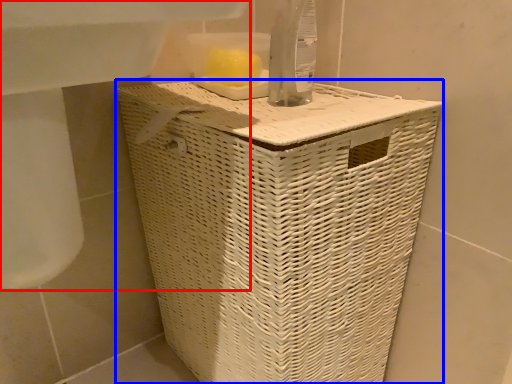
Question: Among these objects, which one is nearest to the camera, sink (highlighted by a red box) or waste container (highlighted by a blue box)?

Choices:
 (A) sink
 (B) waste container

Answer: (A)